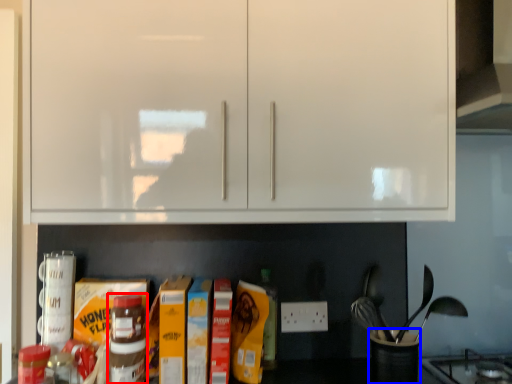
Question: Which object appears closest to the camera in this image, bottle (highlighted by a red box) or appliance (highlighted by a blue box)?

Choices:
 (A) bottle
 (B) appliance

Answer: (A)